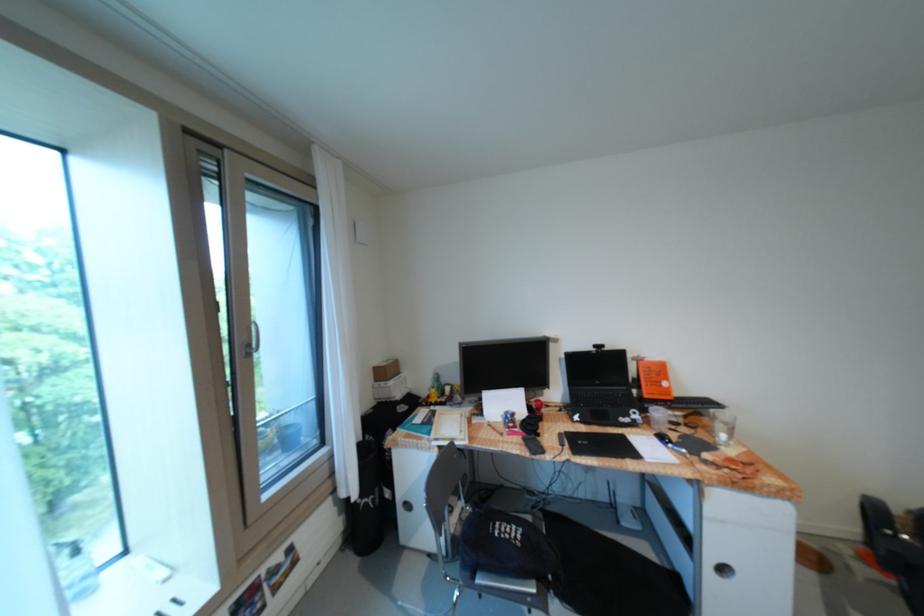
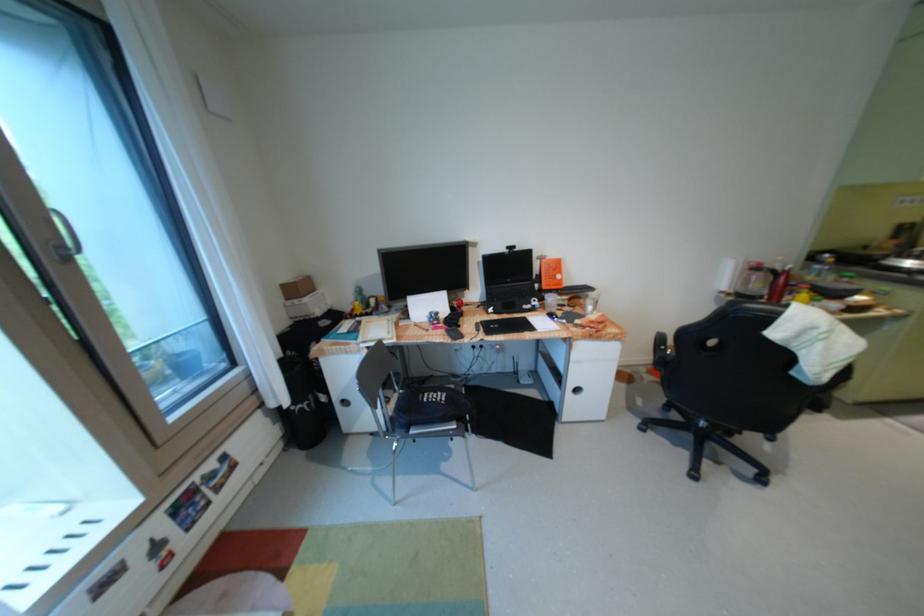
Where in the second image is the point corresponding to the point at 597,347 from the first image?

(512, 249)